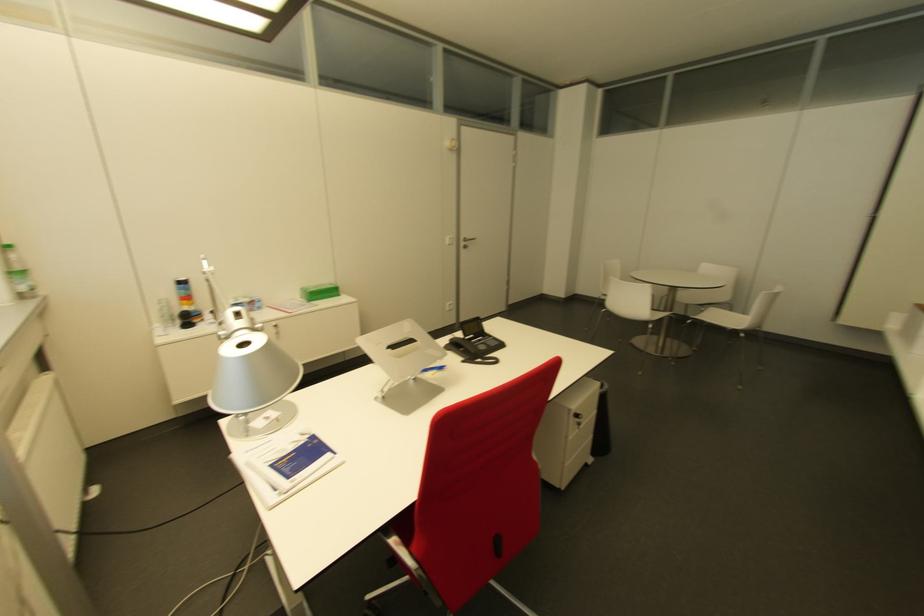
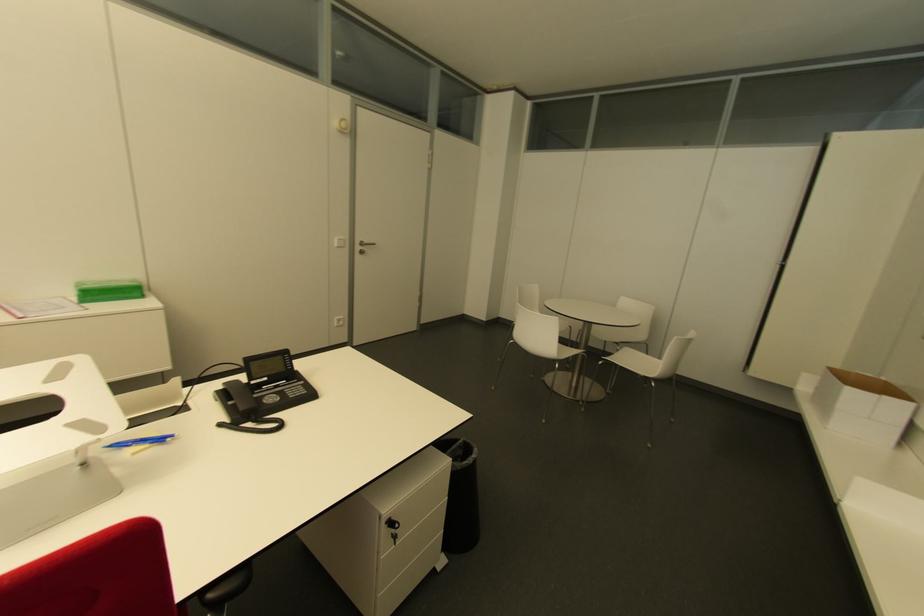
The point at (312, 294) is marked in the first image. Where is the corresponding point in the second image?

(92, 294)